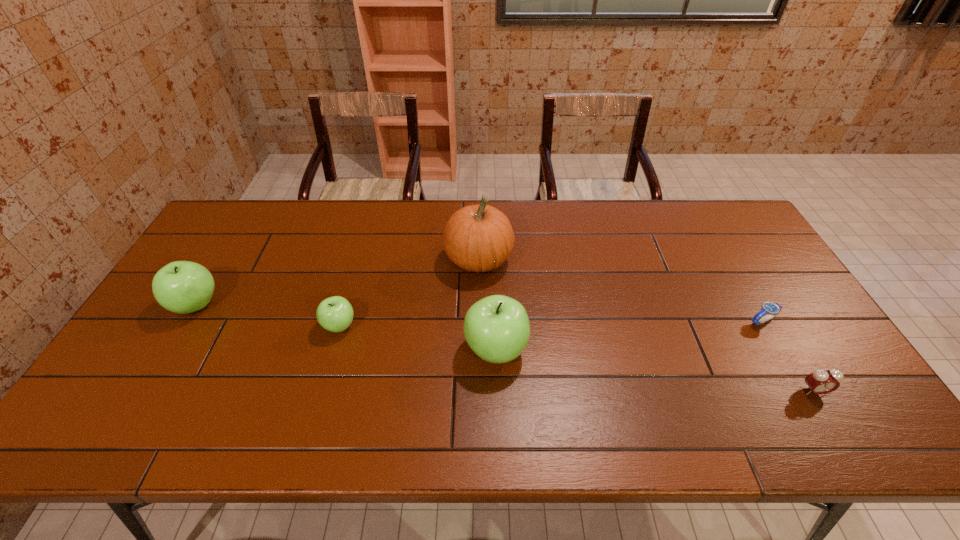
The width and height of the screenshot is (960, 540). I want to click on free space that is in between the rightmost apple and the shortest object, so (629, 335).

Where is `vacant space in between the shortest object and the alarm clock`? This screenshot has height=540, width=960. vacant space in between the shortest object and the alarm clock is located at coordinates (788, 356).

At what (x,y) coordinates should I click in order to perform the action: click on free space between the tallest object and the watch. Please return your answer as a coordinate pair (x, y). This screenshot has width=960, height=540. Looking at the image, I should click on (620, 291).

In order to click on object that is the third closest to the rightmost apple in this screenshot , I will do `click(771, 309)`.

Locate which object is the closest to the shortest object. Please provide its 2D coordinates. Your answer should be formatted as a tuple, i.e. [(x, y)], where the tuple contains the x and y coordinates of a point satisfying the conditions above.

[(821, 381)]

Point out which apple is positioned as the second nearest to the watch. Please provide its 2D coordinates. Your answer should be formatted as a tuple, i.e. [(x, y)], where the tuple contains the x and y coordinates of a point satisfying the conditions above.

[(335, 314)]

Locate an element on the screen. This screenshot has height=540, width=960. apple that is the second nearest to the fifth object from right to left is located at coordinates (183, 287).

I want to click on free space that satisfies the following two spatial constraints: 1. on the stem of the tallest object; 2. on the right side of the watch, so click(479, 321).

Identify the location of free space that satisfies the following two spatial constraints: 1. on the front side of the leftmost object; 2. on the left side of the rightmost apple. (169, 349).

In order to click on free space that satisfies the following two spatial constraints: 1. on the front side of the rightmost apple; 2. on the left side of the second tallest apple in this screenshot , I will do [x=169, y=349].